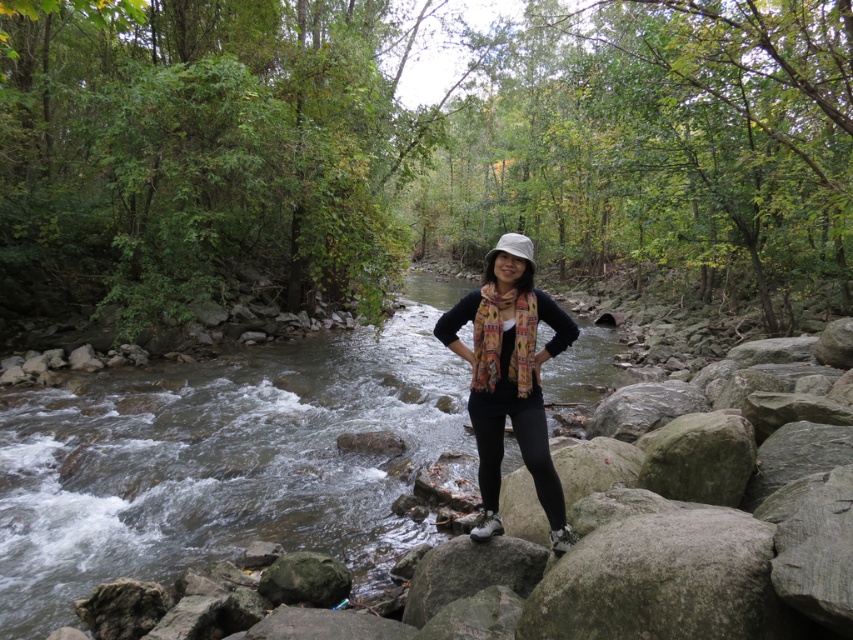
Find the location of a particular element. The image size is (853, 640). clear water at stream center is located at coordinates (219, 460).

You are a GUI agent. You are given a task and a screenshot of the screen. Output one action in this format:
    pyautogui.click(x=<x>, y=<y>)
    Task: Click on the clear water at stream center
    
    Given the screenshot: What is the action you would take?
    pyautogui.click(x=219, y=460)